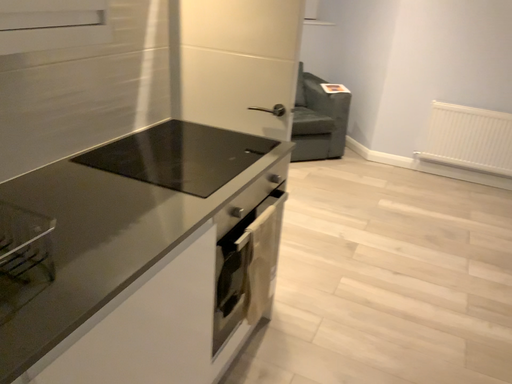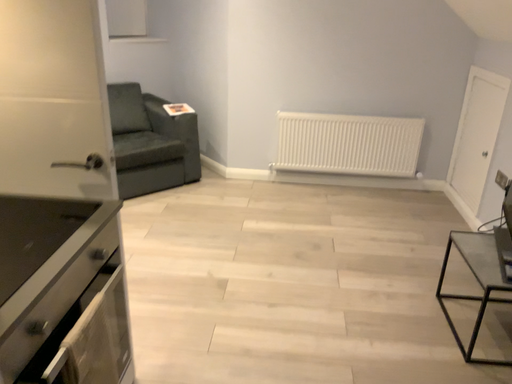
Question: How did the camera likely rotate when shooting the video?

Choices:
 (A) rotated left
 (B) rotated right

Answer: (B)